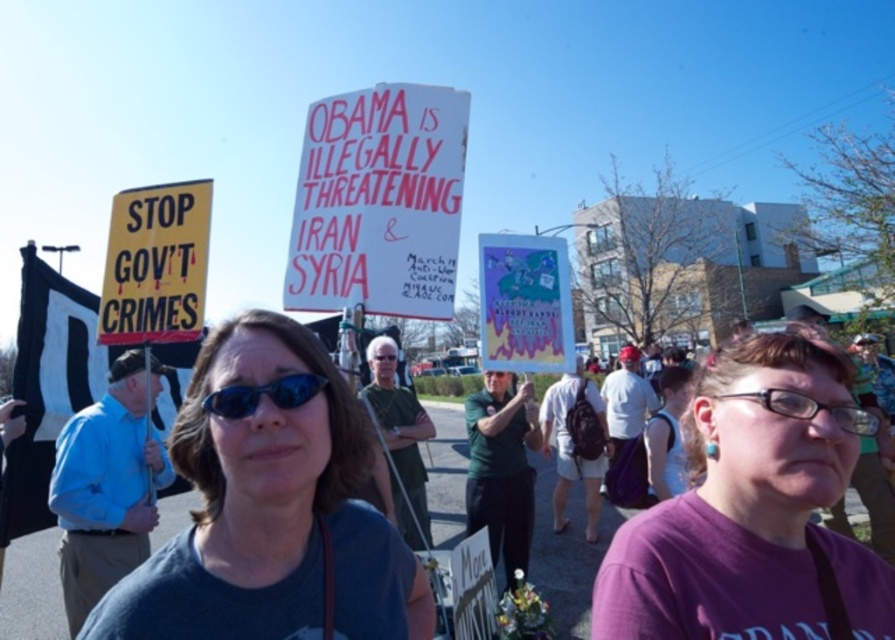
You are a photographer taking a picture of the protest scene. You want to focus on the purple fabric shirt at center. Where should you aim your camera to capture it?

The purple fabric shirt at center is located at the 2D coordinates point (x=753, y=513), so you should aim your camera at that point to capture it.

You are a photographer at the protest scene. You want to take a photo that includes both the purple fabric shirt at center and the pink paper sign at center. Based on their positions, which object should be placed lower in the photo?

The purple fabric shirt at center is below the pink paper sign at center, so to include both in the photo, the purple fabric shirt at center should be placed lower in the photo.

From the picture: You are a photographer trying to capture a clear photo of the purple fabric shirt at center and the pink paper sign at center. Your camera has a maximum focus range of 5 feet. Can you take a photo that clearly shows both objects without moving your position?

The purple fabric shirt at center and the pink paper sign at center are 5.17 feet apart. Since the distance between them exceeds the camera maximum focus range of 5 feet, you cannot take a photo that clearly shows both objects without moving your position.